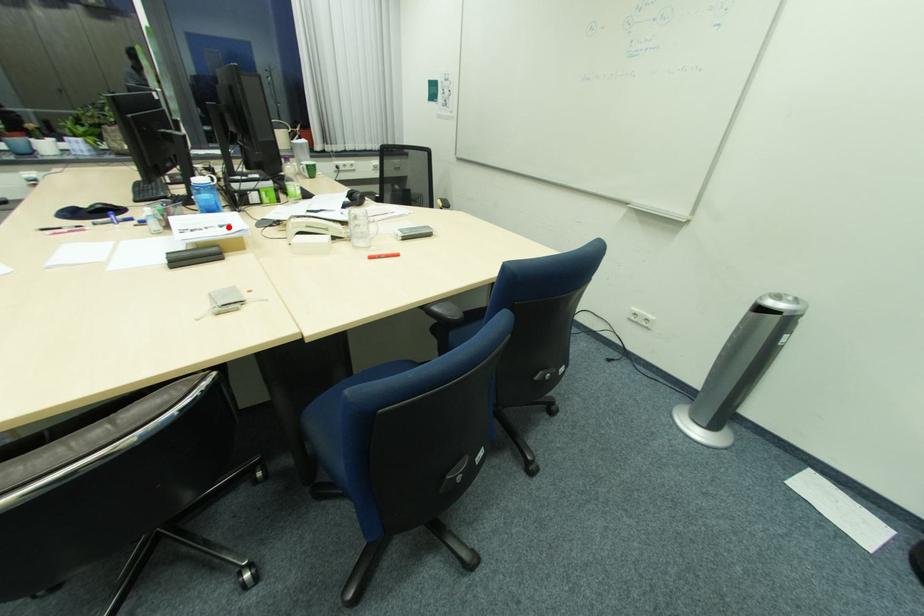
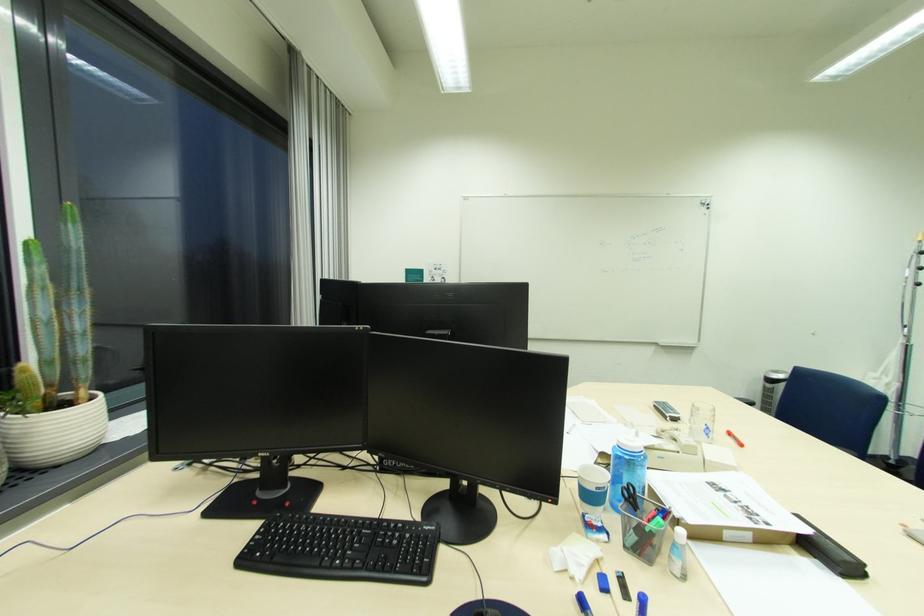
Locate, in the second image, the point that corresponds to the highlighted location in the first image.

(731, 491)